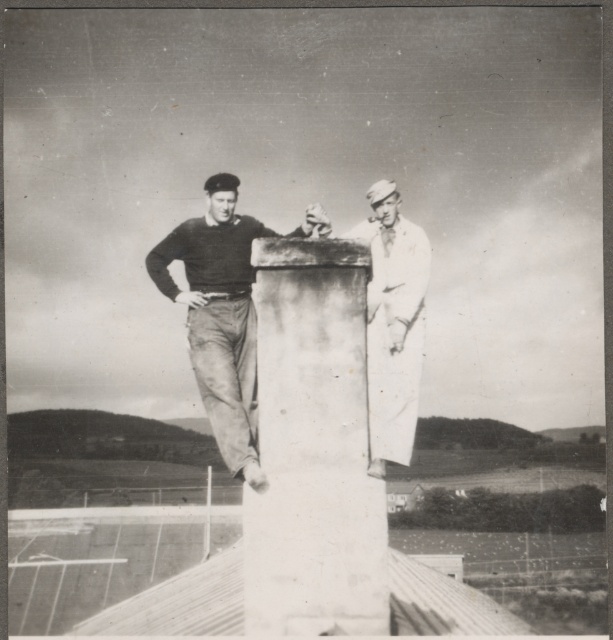
Is point (305, 620) in front of point (400, 218)?

Yes, it is.

Who is taller, white stone pillar at center or white clothed sailor at right?

Standing taller between the two is white stone pillar at center.

In order to click on white stone pillar at center in this screenshot , I will do `click(313, 448)`.

Between white stone pillar at center and dark gray sweater at center, which one appears on the left side from the viewer's perspective?

From the viewer's perspective, dark gray sweater at center appears more on the left side.

Consider the image. Is white stone pillar at center to the right of dark gray sweater at center from the viewer's perspective?

Yes, white stone pillar at center is to the right of dark gray sweater at center.

The image size is (613, 640). Find the location of `white stone pillar at center`. white stone pillar at center is located at coordinates (313, 448).

Locate an element on the screen. The width and height of the screenshot is (613, 640). white stone pillar at center is located at coordinates (313, 448).

Between point (237, 291) and point (398, 374), which one is positioned in front?

Point (398, 374) is in front.

Is dark gray sweater at center in front of white clothed sailor at right?

Yes, dark gray sweater at center is in front of white clothed sailor at right.

Is point (240, 394) more distant than point (400, 422)?

Yes.

Image resolution: width=613 pixels, height=640 pixels. I want to click on dark gray sweater at center, so click(x=219, y=317).